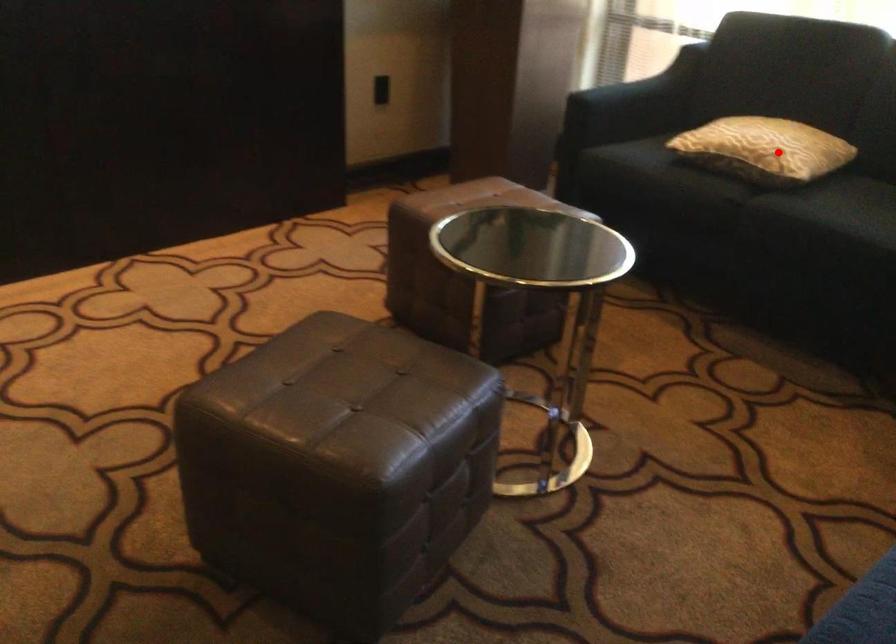
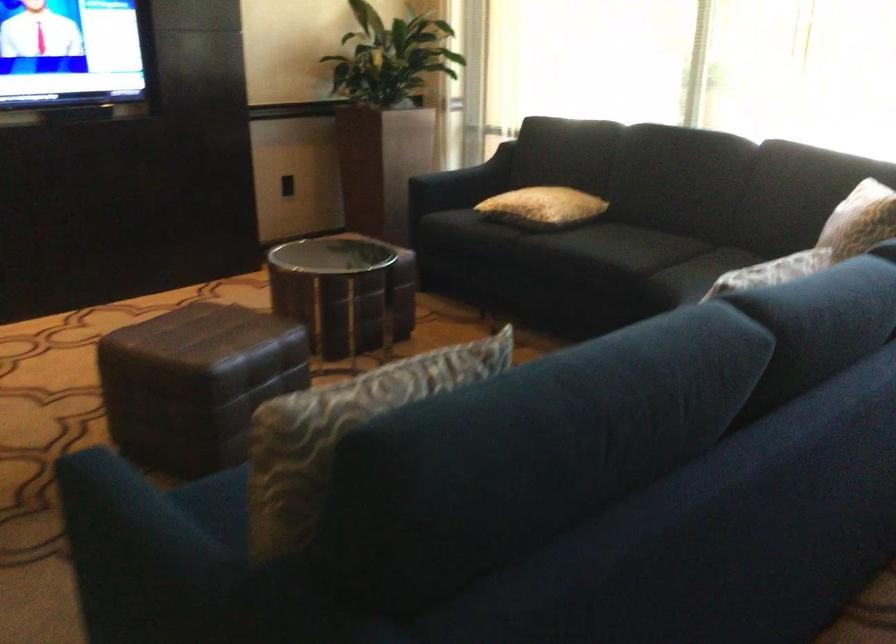
Question: I am providing you with two images of the same scene from different viewpoints. Image1 has a red point marked. In image2, the corresponding 3D location appears at what relative position? Reply with the corresponding letter.

Choices:
 (A) Closer
 (B) Farther

Answer: (B)